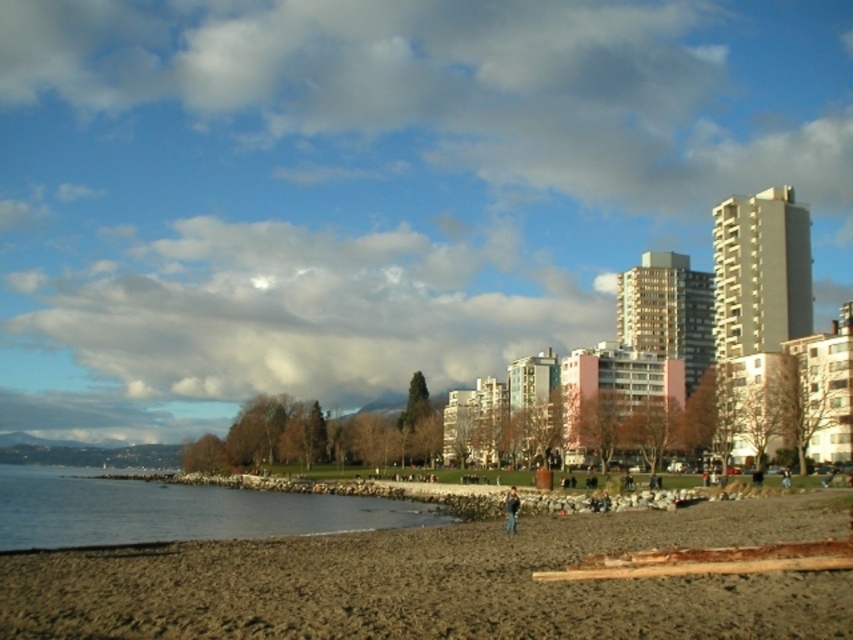
Question: Does brown sandy beach at lower left have a lesser width compared to dark brown leather jacket at lower center?

Choices:
 (A) yes
 (B) no

Answer: (B)

Question: Is brown sandy beach at lower left wider than clear water at lower left?

Choices:
 (A) yes
 (B) no

Answer: (B)

Question: Which point is closer to the camera?

Choices:
 (A) (761, 604)
 (B) (218, 525)

Answer: (A)

Question: Based on their relative distances, which object is nearer to the brown sandy beach at lower left?

Choices:
 (A) clear water at lower left
 (B) dark brown leather jacket at lower center

Answer: (B)

Question: Is brown sandy beach at lower left wider than dark brown leather jacket at lower center?

Choices:
 (A) no
 (B) yes

Answer: (B)

Question: Which of the following is the closest to the observer?

Choices:
 (A) (577, 618)
 (B) (514, 513)

Answer: (A)